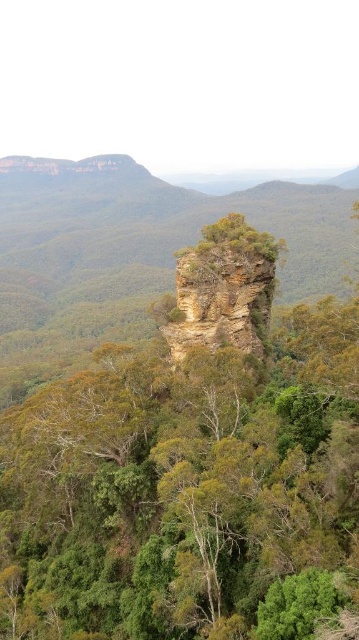
Can you confirm if green rough rock formation at center is taller than brown rough rock at center?

Correct, green rough rock formation at center is much taller as brown rough rock at center.

Who is positioned more to the left, green rough rock formation at center or brown rough rock at center?

Positioned to the left is green rough rock formation at center.

What do you see at coordinates (190, 468) in the screenshot? I see `green rough rock formation at center` at bounding box center [190, 468].

At what (x,y) coordinates should I click in order to perform the action: click on green rough rock formation at center. Please return your answer as a coordinate pair (x, y). Looking at the image, I should click on (190, 468).